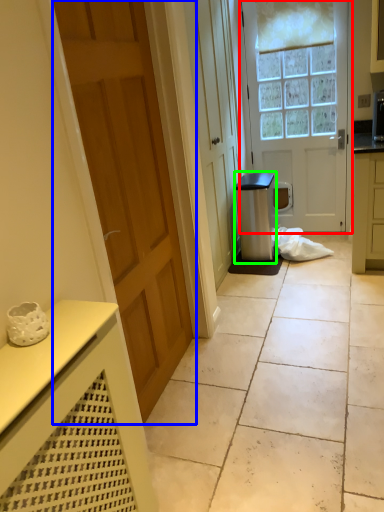
Question: Which object is the closest to the door (highlighted by a red box)? Choose among these: door (highlighted by a blue box) or appliance (highlighted by a green box).

Choices:
 (A) door
 (B) appliance

Answer: (B)